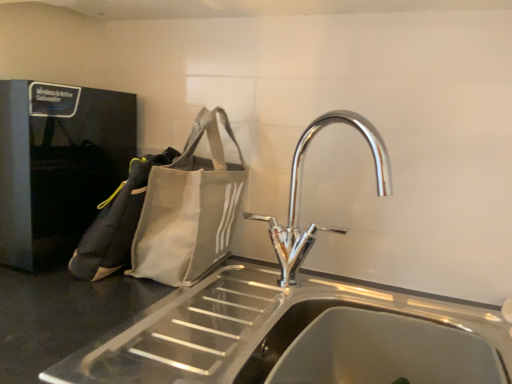
Based on the photo, measure the distance between point (172, 266) and camera.

30.67 inches.

Image resolution: width=512 pixels, height=384 pixels. What do you see at coordinates (189, 209) in the screenshot?
I see `gray fabric tote bag at left, which is the 2th pouch from left to right` at bounding box center [189, 209].

Describe the element at coordinates (298, 193) in the screenshot. I see `chrome metallic tap at center` at that location.

Where is `white canvas tote bag at left, the second pouch positioned from the right`? white canvas tote bag at left, the second pouch positioned from the right is located at coordinates (116, 223).

At what (x,y) coordinates should I click in order to perform the action: click on gray fabric tote bag at left, which is the first pouch from right to left. Please return your answer as a coordinate pair (x, y). This screenshot has width=512, height=384. Looking at the image, I should click on (189, 209).

From a real-world perspective, which is physically below, gray fabric tote bag at left, which is the first pouch from right to left, or white canvas tote bag at left, which is the 1th pouch in left-to-right order?

white canvas tote bag at left, which is the 1th pouch in left-to-right order.

Does point (156, 170) come behind point (89, 249)?

Yes.

How many degrees apart are the facing directions of gray fabric tote bag at left, which is the first pouch from right to left, and white canvas tote bag at left, which is the 1th pouch in left-to-right order?

The facing directions of gray fabric tote bag at left, which is the first pouch from right to left, and white canvas tote bag at left, which is the 1th pouch in left-to-right order, are 70.9 degrees apart.

What's the angular difference between chrome metallic tap at center and white canvas tote bag at left, the second pouch positioned from the right,'s facing directions?

The angle between the facing direction of chrome metallic tap at center and the facing direction of white canvas tote bag at left, the second pouch positioned from the right, is 72.7 degrees.

Is chrome metallic tap at center situated inside white canvas tote bag at left, the second pouch positioned from the right, or outside?

chrome metallic tap at center cannot be found inside white canvas tote bag at left, the second pouch positioned from the right.

Is chrome metallic tap at center shorter than white canvas tote bag at left, the second pouch positioned from the right?

Incorrect, the height of chrome metallic tap at center does not fall short of that of white canvas tote bag at left, the second pouch positioned from the right.

Is chrome metallic tap at center in front of or behind white canvas tote bag at left, the second pouch positioned from the right, in the image?

Visually, chrome metallic tap at center is located in front of white canvas tote bag at left, the second pouch positioned from the right.

From the image's perspective, is chrome metallic tap at center positioned above or below gray fabric tote bag at left, which is the 2th pouch from left to right?

chrome metallic tap at center is situated lower than gray fabric tote bag at left, which is the 2th pouch from left to right, in the image.

Can you tell me how much chrome metallic tap at center and gray fabric tote bag at left, which is the first pouch from right to left, differ in facing direction?

The facing directions of chrome metallic tap at center and gray fabric tote bag at left, which is the first pouch from right to left, are 1.85 degrees apart.

Who is shorter, chrome metallic tap at center or gray fabric tote bag at left, which is the 2th pouch from left to right?

With less height is chrome metallic tap at center.

From a real-world perspective, between white canvas tote bag at left, which is the 1th pouch in left-to-right order, and stainless steel sink at center, who is vertically higher?

In real-world perspective, white canvas tote bag at left, which is the 1th pouch in left-to-right order, is above.

Is white canvas tote bag at left, the second pouch positioned from the right, placed right next to stainless steel sink at center?

No, white canvas tote bag at left, the second pouch positioned from the right, is not touching stainless steel sink at center.

Considering the relative positions of white canvas tote bag at left, which is the 1th pouch in left-to-right order, and stainless steel sink at center in the image provided, is white canvas tote bag at left, which is the 1th pouch in left-to-right order, to the left or to the right of stainless steel sink at center?

white canvas tote bag at left, which is the 1th pouch in left-to-right order, is to the left of stainless steel sink at center.

The width and height of the screenshot is (512, 384). What are the coordinates of `the 1st pouch positioned above the stainless steel sink at center (from a real-world perspective)` in the screenshot? It's located at (116, 223).

Does stainless steel sink at center have a greater height compared to white canvas tote bag at left, the second pouch positioned from the right?

In fact, stainless steel sink at center may be shorter than white canvas tote bag at left, the second pouch positioned from the right.

Which object is positioned more to the left, stainless steel sink at center or white canvas tote bag at left, which is the 1th pouch in left-to-right order?

white canvas tote bag at left, which is the 1th pouch in left-to-right order, is more to the left.

In the image, there is a white canvas tote bag at left, the second pouch positioned from the right. In order to click on sink below it (from a real-world perspective) in this screenshot , I will do `click(369, 348)`.

From the image's perspective, is stainless steel sink at center positioned above or below chrome metallic tap at center?

stainless steel sink at center is below chrome metallic tap at center.

Is the position of stainless steel sink at center less distant than that of chrome metallic tap at center?

Yes, the depth of stainless steel sink at center is less than that of chrome metallic tap at center.

Is chrome metallic tap at center surrounded by stainless steel sink at center?

No, chrome metallic tap at center is not surrounded by stainless steel sink at center.

Considering the positions of objects stainless steel sink at center and chrome metallic tap at center in the image provided, who is more to the right, stainless steel sink at center or chrome metallic tap at center?

Positioned to the right is stainless steel sink at center.

Is chrome metallic tap at center oriented towards stainless steel sink at center?

No, chrome metallic tap at center is not turned towards stainless steel sink at center.

Is stainless steel sink at center located within chrome metallic tap at center?

No, stainless steel sink at center is not surrounded by chrome metallic tap at center.

Is chrome metallic tap at center closer to camera compared to stainless steel sink at center?

No, chrome metallic tap at center is further to the viewer.

Identify the location of sink on the right of chrome metallic tap at center. The height and width of the screenshot is (384, 512). (369, 348).

There is a white canvas tote bag at left, which is the 1th pouch in left-to-right order. Where is `pouch above it (from a real-world perspective)`? The width and height of the screenshot is (512, 384). pouch above it (from a real-world perspective) is located at coordinates (189, 209).

Starting from the chrome metallic tap at center, which pouch is the 2nd one to the left? Please provide its 2D coordinates.

[(116, 223)]

When comparing their distances from stainless steel sink at center, does white canvas tote bag at left, the second pouch positioned from the right, or gray fabric tote bag at left, which is the first pouch from right to left, seem closer?

Among the two, gray fabric tote bag at left, which is the first pouch from right to left, is located nearer to stainless steel sink at center.

Based on their spatial positions, is gray fabric tote bag at left, which is the first pouch from right to left, or stainless steel sink at center further from white canvas tote bag at left, the second pouch positioned from the right?

stainless steel sink at center is positioned further to the anchor white canvas tote bag at left, the second pouch positioned from the right.

Considering their positions, is chrome metallic tap at center positioned closer to stainless steel sink at center than gray fabric tote bag at left, which is the first pouch from right to left?

chrome metallic tap at center lies closer to stainless steel sink at center than the other object.

Based on their spatial positions, is gray fabric tote bag at left, which is the first pouch from right to left, or stainless steel sink at center closer to chrome metallic tap at center?

gray fabric tote bag at left, which is the first pouch from right to left, is positioned closer to the anchor chrome metallic tap at center.

Based on the photo, looking at the image, which one is located closer to white canvas tote bag at left, the second pouch positioned from the right, stainless steel sink at center or gray fabric tote bag at left, which is the 2th pouch from left to right?

gray fabric tote bag at left, which is the 2th pouch from left to right.

From the image, which object appears to be farther from gray fabric tote bag at left, which is the 2th pouch from left to right, chrome metallic tap at center or white canvas tote bag at left, the second pouch positioned from the right?

The object further to gray fabric tote bag at left, which is the 2th pouch from left to right, is chrome metallic tap at center.

Looking at the image, which one is located further to chrome metallic tap at center, gray fabric tote bag at left, which is the 2th pouch from left to right, or white canvas tote bag at left, which is the 1th pouch in left-to-right order?

Among the two, white canvas tote bag at left, which is the 1th pouch in left-to-right order, is located further to chrome metallic tap at center.

Considering their positions, is white canvas tote bag at left, which is the 1th pouch in left-to-right order, positioned closer to gray fabric tote bag at left, which is the first pouch from right to left, than chrome metallic tap at center?

Among the two, white canvas tote bag at left, which is the 1th pouch in left-to-right order, is located nearer to gray fabric tote bag at left, which is the first pouch from right to left.

The height and width of the screenshot is (384, 512). I want to click on tap located between white canvas tote bag at left, the second pouch positioned from the right, and stainless steel sink at center in the left-right direction, so click(x=298, y=193).

Image resolution: width=512 pixels, height=384 pixels. Identify the location of tap between gray fabric tote bag at left, which is the first pouch from right to left, and stainless steel sink at center, in the vertical direction. (298, 193).

The image size is (512, 384). I want to click on pouch between white canvas tote bag at left, the second pouch positioned from the right, and stainless steel sink at center, so click(x=189, y=209).

The height and width of the screenshot is (384, 512). I want to click on pouch between white canvas tote bag at left, the second pouch positioned from the right, and chrome metallic tap at center from left to right, so click(189, 209).